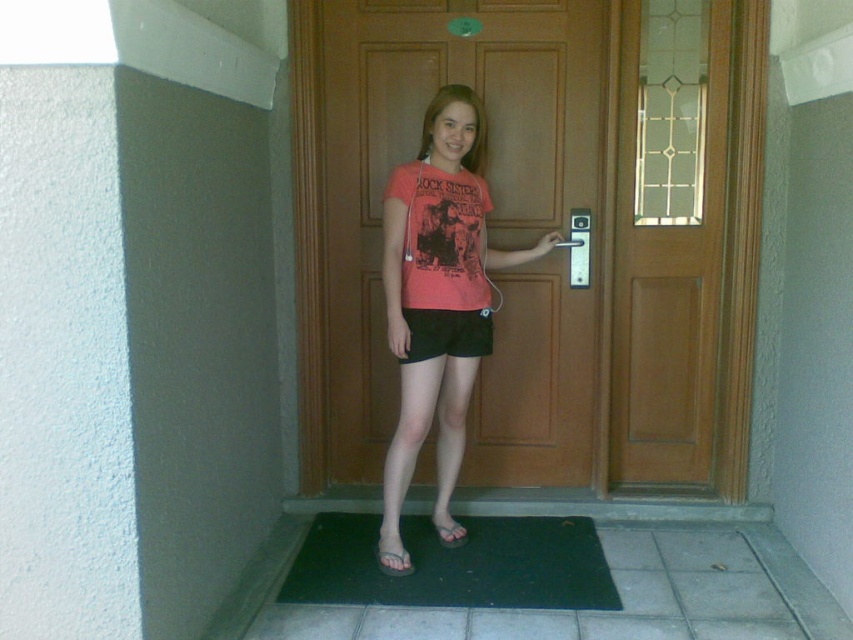
Image resolution: width=853 pixels, height=640 pixels. Describe the element at coordinates (418, 150) in the screenshot. I see `brown wooden door at center` at that location.

Is point (473, 65) closer to camera compared to point (412, 323)?

No, (473, 65) is behind (412, 323).

Locate an element on the screen. This screenshot has width=853, height=640. brown wooden door at center is located at coordinates (418, 150).

Measure the distance between pink matte t-shirt at center and black matte shorts at center.

5.67 inches

Is point (463, 136) farther from camera compared to point (437, 340)?

That is False.

Who is more distant from viewer, (x=408, y=570) or (x=434, y=326)?

Point (x=434, y=326)

At what (x,y) coordinates should I click in order to perform the action: click on pink matte t-shirt at center. Please return your answer as a coordinate pair (x, y). This screenshot has width=853, height=640. Looking at the image, I should click on (437, 304).

Can you confirm if brown wooden door at center is wider than pink matte t-shirt at center?

Correct, the width of brown wooden door at center exceeds that of pink matte t-shirt at center.

Is brown wooden door at center smaller than pink matte t-shirt at center?

No.

In order to click on brown wooden door at center in this screenshot , I will do `click(418, 150)`.

Locate an element on the screen. brown wooden door at center is located at coordinates (418, 150).